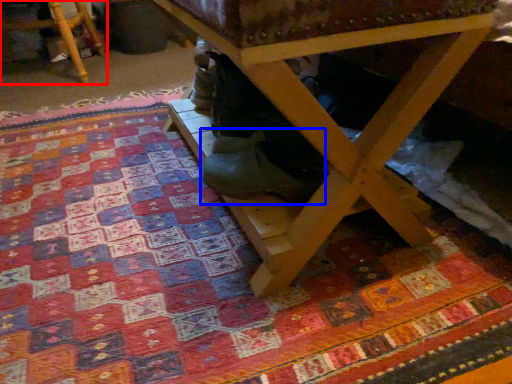
Question: Among these objects, which one is nearest to the camera, furniture (highlighted by a red box) or shoe (highlighted by a blue box)?

Choices:
 (A) furniture
 (B) shoe

Answer: (B)